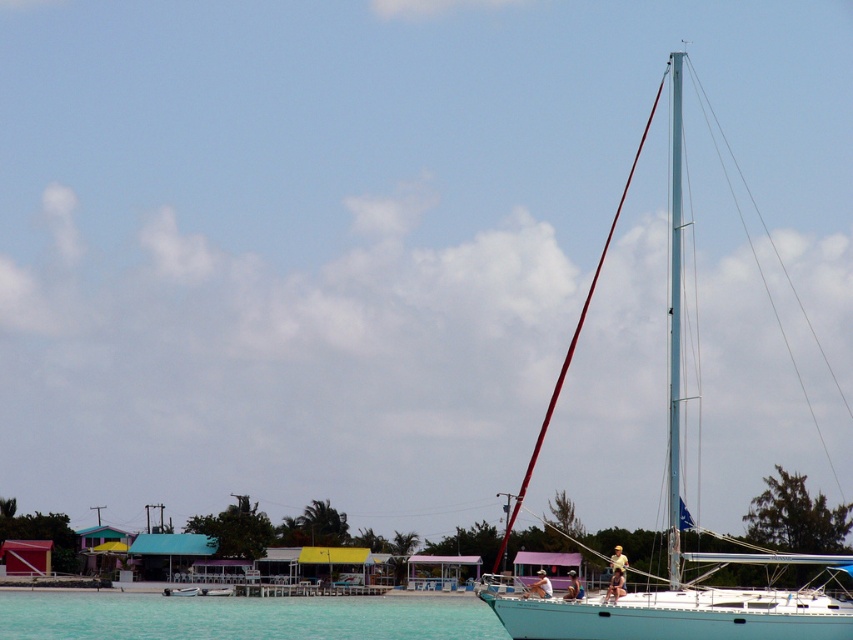
Question: Which point is farther to the camera?

Choices:
 (A) (566, 602)
 (B) (258, 636)

Answer: (B)

Question: Is teal matte sailboat at right to the left of white metallic mast at center from the viewer's perspective?

Choices:
 (A) no
 (B) yes

Answer: (B)

Question: Which point is farther from the camera taking this photo?

Choices:
 (A) (677, 122)
 (B) (457, 625)

Answer: (B)

Question: Does teal matte sailboat at right appear under clear blue water at lower left?

Choices:
 (A) no
 (B) yes

Answer: (A)

Question: In this image, where is clear blue water at lower left located relative to white metallic mast at center?

Choices:
 (A) right
 (B) left

Answer: (B)

Question: Which of the following is the closest to the observer?

Choices:
 (A) white metallic mast at center
 (B) teal matte sailboat at right
 (C) clear blue water at lower left

Answer: (B)